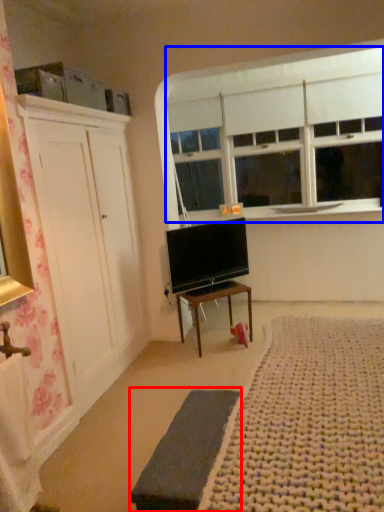
Question: Which object appears farthest to the camera in this image, bed frame (highlighted by a red box) or window (highlighted by a blue box)?

Choices:
 (A) bed frame
 (B) window

Answer: (B)